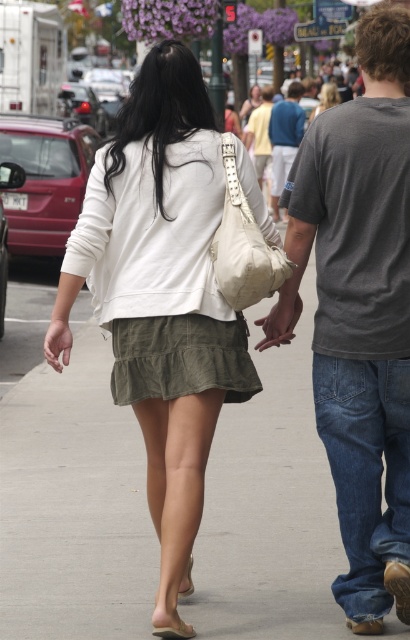
You are standing at the camera position and want to estimate how far the blue cotton shirt at center is from you. Based on the scene, can you determine the distance?

The blue cotton shirt at center is 20.80 meters away from the camera position.